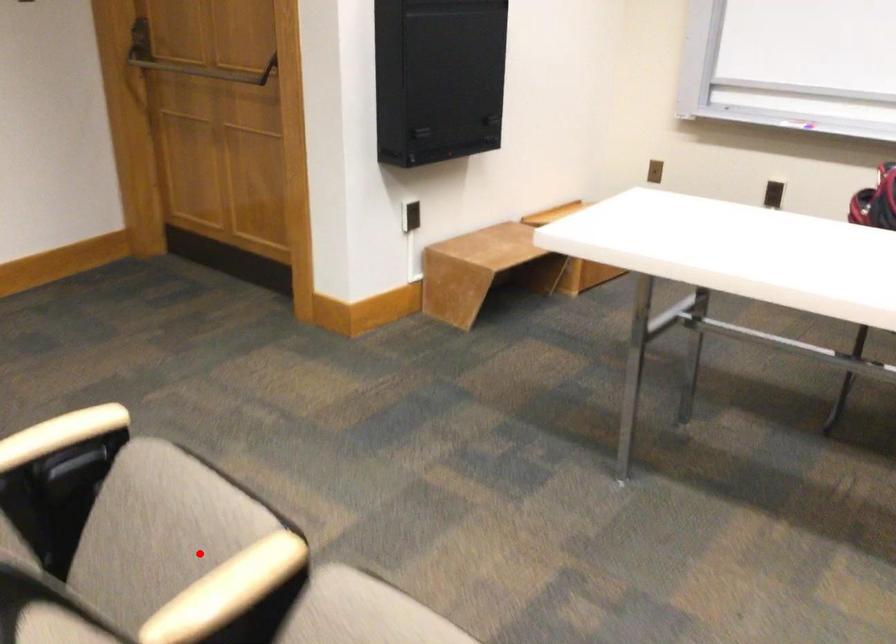
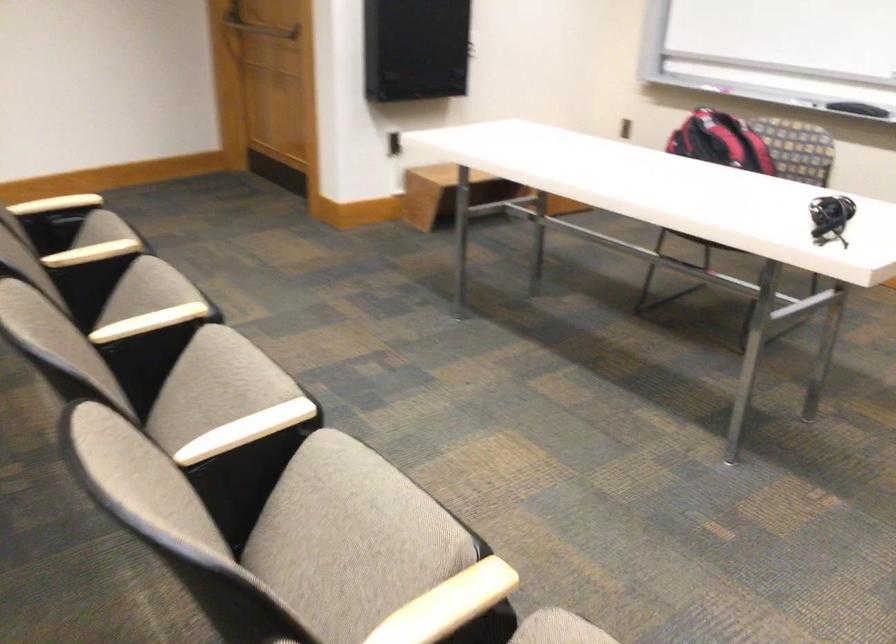
Locate, in the second image, the point that corresponds to the highlighted location in the first image.

(92, 252)